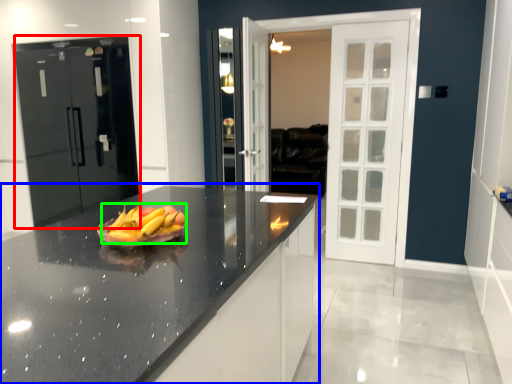
Question: Which is farther away from door (highlighted by a red box)? countertop (highlighted by a blue box) or grapefruit (highlighted by a green box)?

Choices:
 (A) countertop
 (B) grapefruit

Answer: (B)